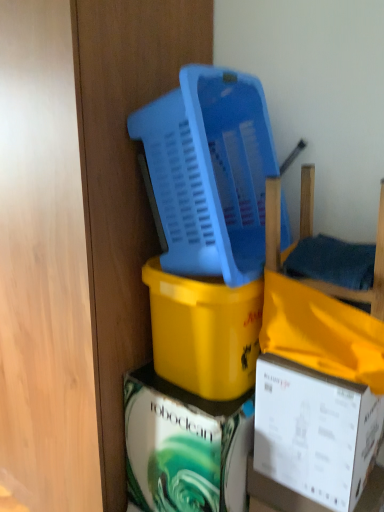
Question: Can you confirm if yellow matte plastic bucket at center, which ranks as the first box in top-to-bottom order, is taller than wooden chair at right?

Choices:
 (A) no
 (B) yes

Answer: (B)

Question: Is yellow matte plastic bucket at center, which ranks as the first box in top-to-bottom order, further to the viewer compared to wooden chair at right?

Choices:
 (A) no
 (B) yes

Answer: (B)

Question: Is the surface of yellow matte plastic bucket at center, which ranks as the first box in top-to-bottom order, in direct contact with wooden chair at right?

Choices:
 (A) yes
 (B) no

Answer: (B)

Question: Could you tell me if yellow matte plastic bucket at center, which ranks as the first box in top-to-bottom order, is facing wooden chair at right?

Choices:
 (A) no
 (B) yes

Answer: (A)

Question: Would you consider yellow matte plastic bucket at center, which ranks as the first box in top-to-bottom order, to be distant from wooden chair at right?

Choices:
 (A) no
 (B) yes

Answer: (A)

Question: Is white cardboard box at lower right, which appears as the 2th box when ordered from the bottom, bigger or smaller than blue plastic basket at upper center?

Choices:
 (A) small
 (B) big

Answer: (A)

Question: From a real-world perspective, is white cardboard box at lower right, which appears as the 2th box when ordered from the bottom, positioned above or below blue plastic basket at upper center?

Choices:
 (A) below
 (B) above

Answer: (A)

Question: From their relative heights in the image, would you say white cardboard box at lower right, which is the second box from top to bottom, is taller or shorter than blue plastic basket at upper center?

Choices:
 (A) tall
 (B) short

Answer: (B)

Question: Is white cardboard box at lower right, which is the second box from top to bottom, to the left or to the right of blue plastic basket at upper center in the image?

Choices:
 (A) left
 (B) right

Answer: (B)

Question: Is point (195, 358) positioned closer to the camera than point (304, 217)?

Choices:
 (A) farther
 (B) closer

Answer: (B)

Question: Considering the positions of yellow matte plastic bucket at center, which ranks as the first box in top-to-bottom order, and wooden chair at right in the image, is yellow matte plastic bucket at center, which ranks as the first box in top-to-bottom order, taller or shorter than wooden chair at right?

Choices:
 (A) tall
 (B) short

Answer: (A)

Question: From a real-world perspective, is yellow matte plastic bucket at center, which ranks as the first box in top-to-bottom order, positioned above or below wooden chair at right?

Choices:
 (A) above
 (B) below

Answer: (B)

Question: Considering the positions of yellow matte plastic bucket at center, which ranks as the first box in top-to-bottom order, and wooden chair at right in the image, is yellow matte plastic bucket at center, which ranks as the first box in top-to-bottom order, bigger or smaller than wooden chair at right?

Choices:
 (A) big
 (B) small

Answer: (A)

Question: Choose the correct answer: Is matte white box at center, the 1th box when ordered from bottom to top, inside wooden chair at right or outside it?

Choices:
 (A) inside
 (B) outside

Answer: (B)

Question: Is matte white box at center, positioned as the 3th box in top-to-bottom order, taller or shorter than wooden chair at right?

Choices:
 (A) tall
 (B) short

Answer: (A)